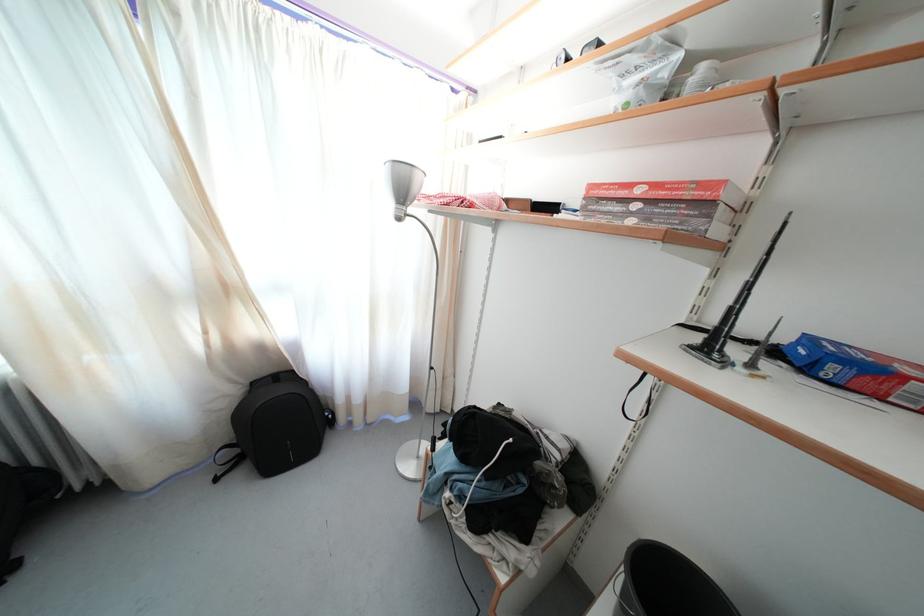
Where would you lift the white plastic bottle? Please return your answer as a coordinate pair (x, y).

(700, 78)